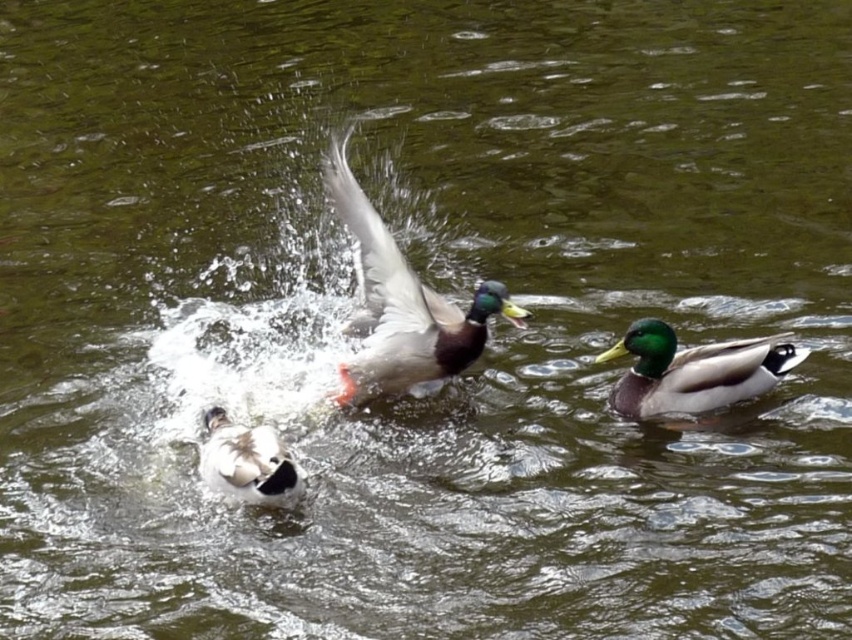
You are a photographer trying to capture the ducks in the scene. The shiny green duck at center and the green glossy duck at right are both in your viewfinder. Which duck should you focus on to ensure the subject is clearly visible in your photo?

The shiny green duck at center is larger in size than the green glossy duck at right, so focusing on the shiny green duck at center will ensure it is clearly visible in your photo due to its larger size.

In the scene shown: You are a photographer trying to capture the ducks in the scene. The green glossy duck at right and the white fluffy duck at lower left are both in your viewfinder. Based on their sizes, which duck would appear larger in the photo?

The green glossy duck at right would appear larger in the photo because its width surpasses the white fluffy duck at lower left.